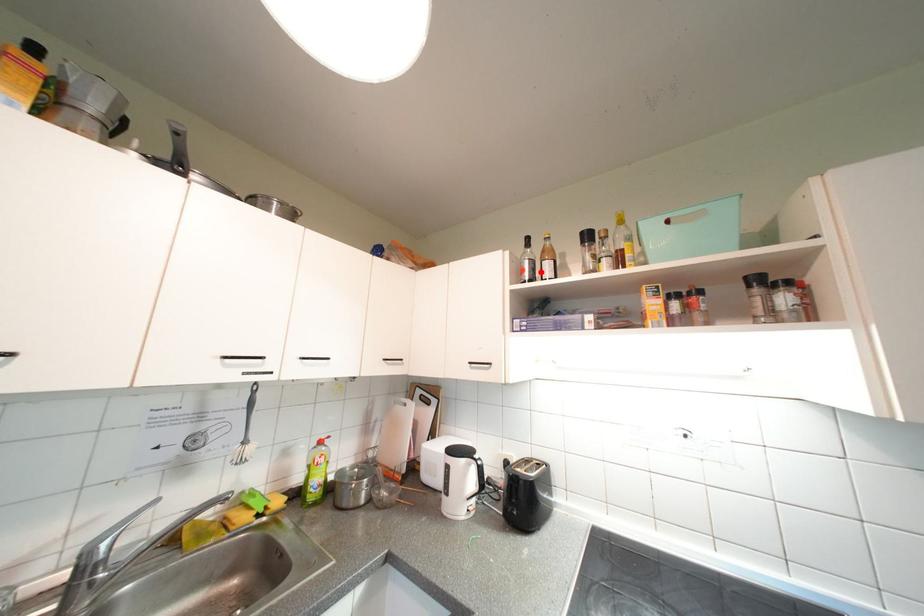
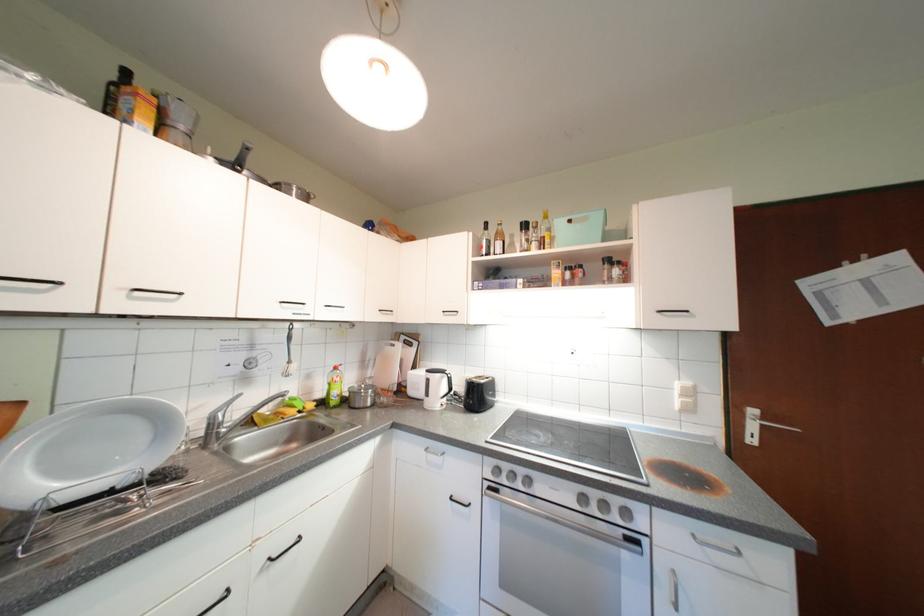
Find the pixel in the second image that matches the highlighted location in the first image.

(496, 249)